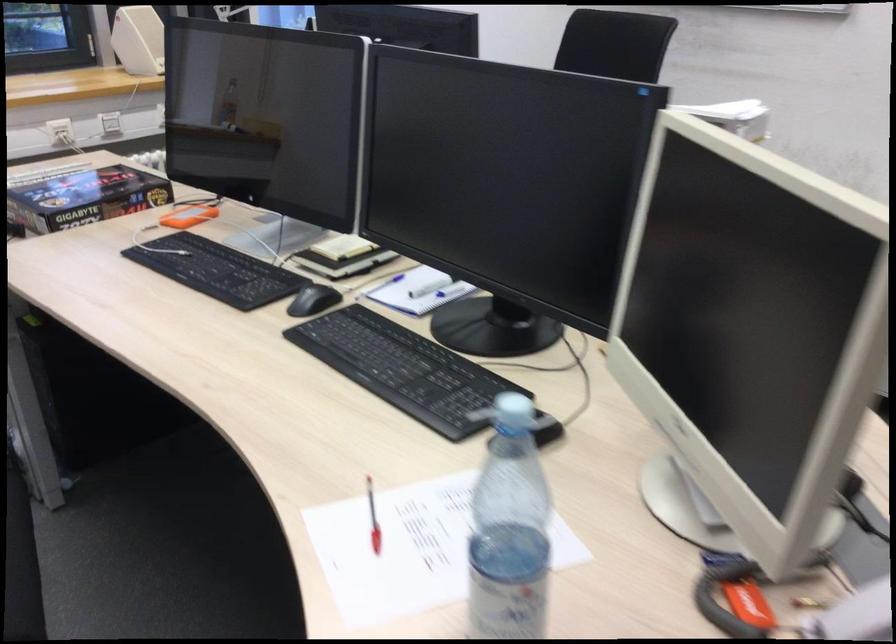
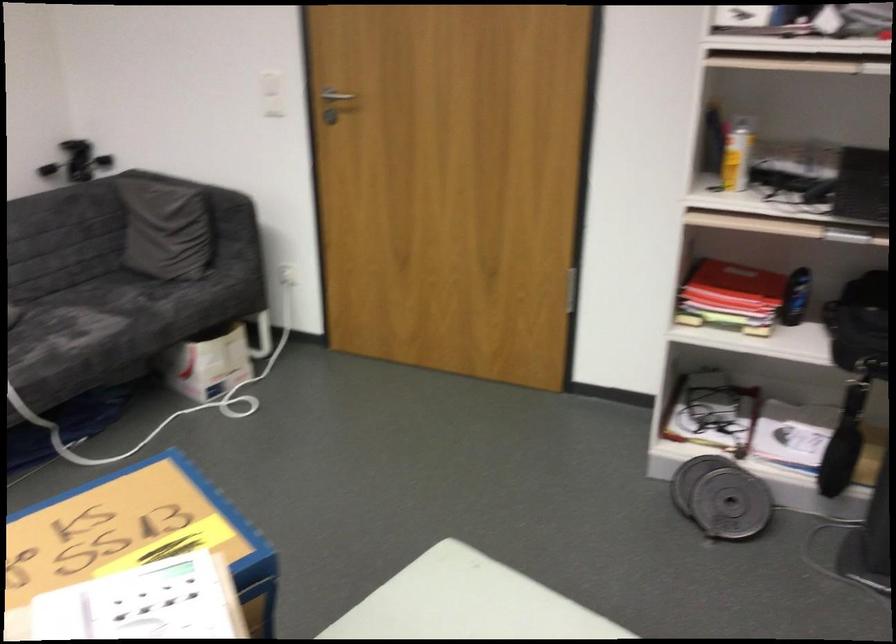
Based on the continuous images, in which direction is the camera rotating?

The rotation direction of the camera is right-down.